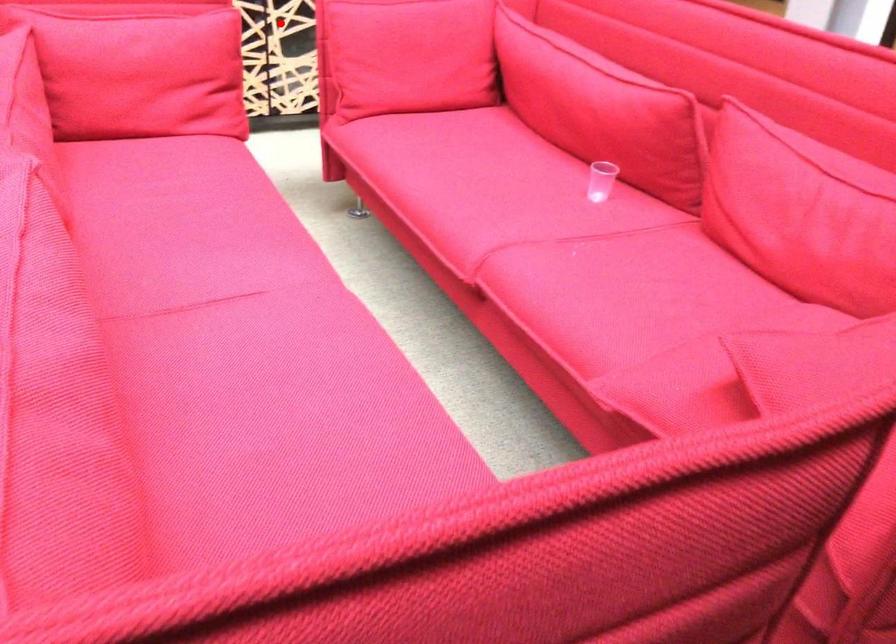
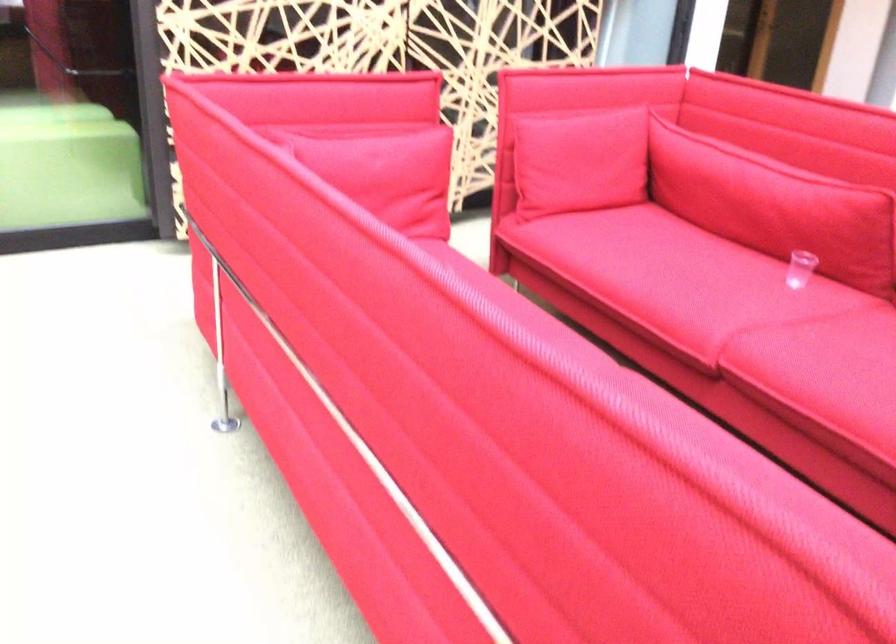
Question: I am providing you with two images of the same scene from different viewpoints. A red point is marked on the first image. Can you still see the location of the red point in image 2?

Choices:
 (A) Yes
 (B) No

Answer: (B)